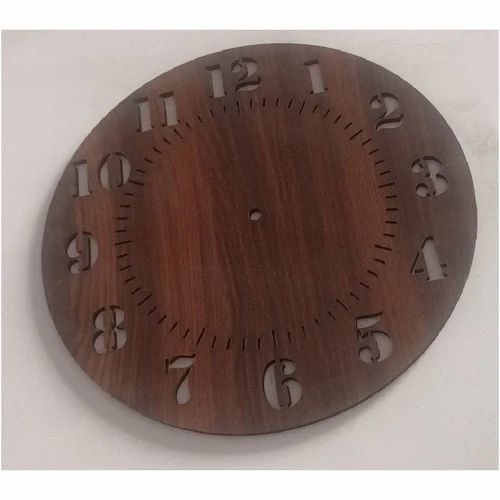
At what (x,y) coordinates should I click in order to perform the action: click on clock face. Please return your answer as a coordinate pair (x, y). Looking at the image, I should click on (290, 267).